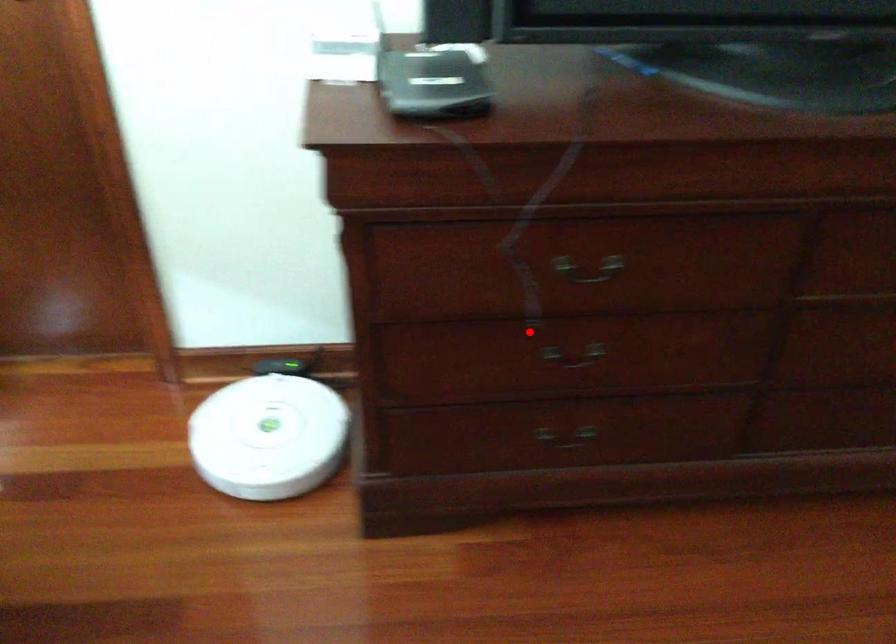
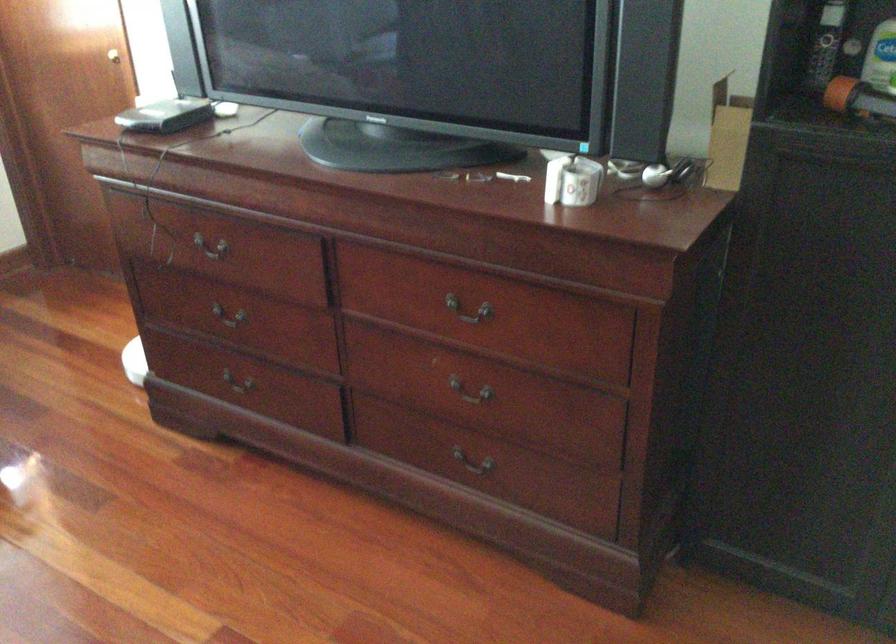
Question: I am providing you with two images of the same scene from different viewpoints. In image1, a red point is highlighted. Considering the same 3D point in image2, which of the following is correct?

Choices:
 (A) It is closer
 (B) It is farther

Answer: (B)